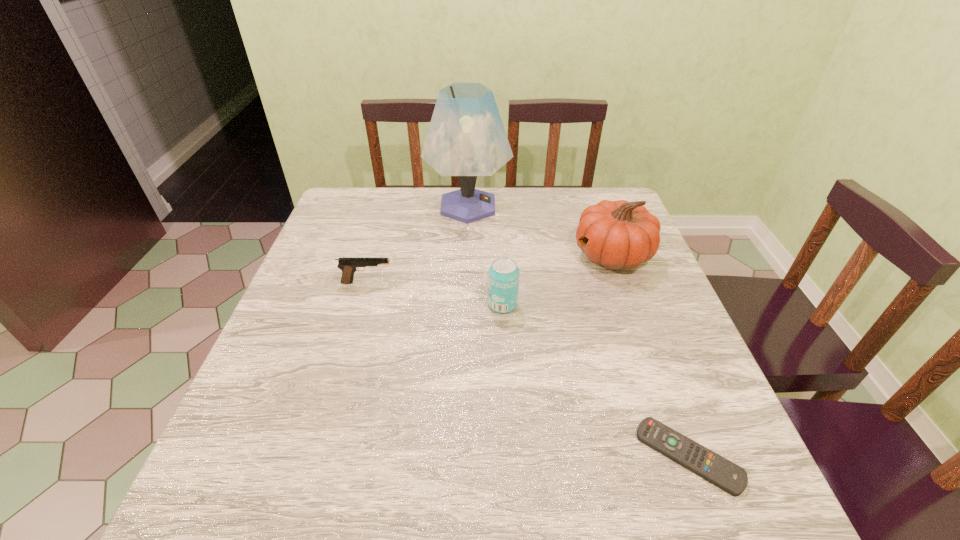
Locate an element on the screen. The width and height of the screenshot is (960, 540). free space that satisfies the following two spatial constraints: 1. on the face of the remote control; 2. on the left side of the fourth shortest object is located at coordinates (685, 456).

At what (x,y) coordinates should I click in order to perform the action: click on vacant space that satisfies the following two spatial constraints: 1. at the muzzle of the fourth farthest object; 2. on the right side of the pistol. Please return your answer as a coordinate pair (x, y). Image resolution: width=960 pixels, height=540 pixels. Looking at the image, I should click on (361, 305).

Find the location of a particular element. This screenshot has height=540, width=960. vacant space that satisfies the following two spatial constraints: 1. on the base of the third shortest object; 2. on the right side of the tallest object is located at coordinates (465, 305).

Find the location of a particular element. free spot that satisfies the following two spatial constraints: 1. on the base of the beer can; 2. on the left side of the lampshade is located at coordinates (465, 305).

I want to click on free space in the image that satisfies the following two spatial constraints: 1. at the muzzle of the fourth tallest object; 2. on the right side of the nearest object, so click(x=317, y=456).